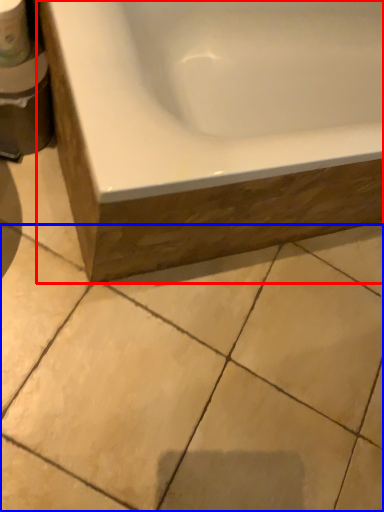
Question: Which object is further to the camera taking this photo, bathtub (highlighted by a red box) or ceramic tile (highlighted by a blue box)?

Choices:
 (A) bathtub
 (B) ceramic tile

Answer: (B)